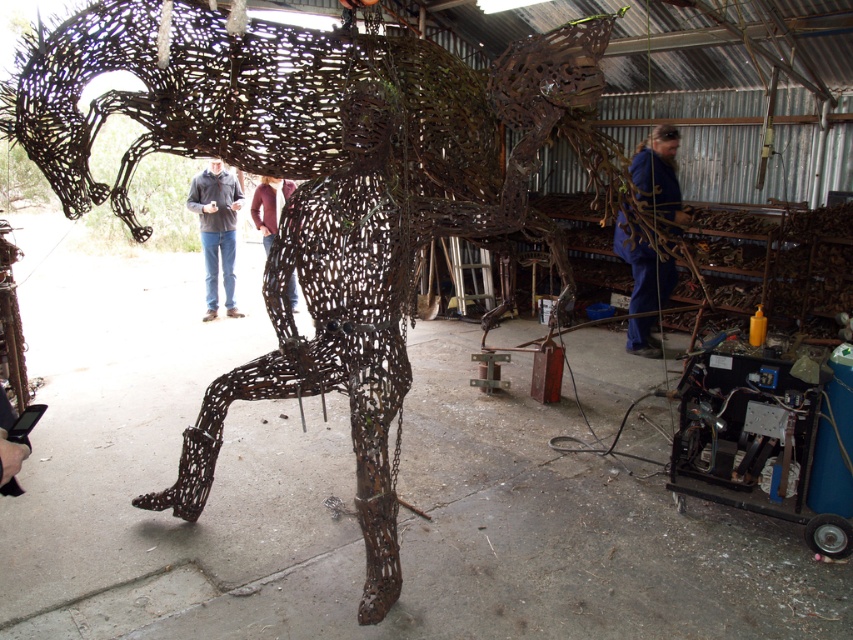
Which of these two, blue fabric at center or matte black jacket at center, stands taller?

With more height is blue fabric at center.

Can you confirm if blue fabric at center is taller than matte black jacket at center?

Indeed, blue fabric at center has a greater height compared to matte black jacket at center.

Does point (634, 288) come in front of point (207, 266)?

Yes, point (634, 288) is closer to viewer.

In order to click on blue fabric at center in this screenshot , I will do `click(659, 173)`.

Locate an element on the screen. This screenshot has height=640, width=853. rusty wire horse at center is located at coordinates (318, 189).

Which is more to the left, rusty wire horse at center or matte black jacket at center?

matte black jacket at center is more to the left.

The width and height of the screenshot is (853, 640). In order to click on rusty wire horse at center in this screenshot , I will do `click(318, 189)`.

Based on the photo, can you confirm if rusty wire horse at center is smaller than blue fabric at center?

Actually, rusty wire horse at center might be larger than blue fabric at center.

Who is lower down, rusty wire horse at center or blue fabric at center?

rusty wire horse at center is below.

Identify the location of rusty wire horse at center. (318, 189).